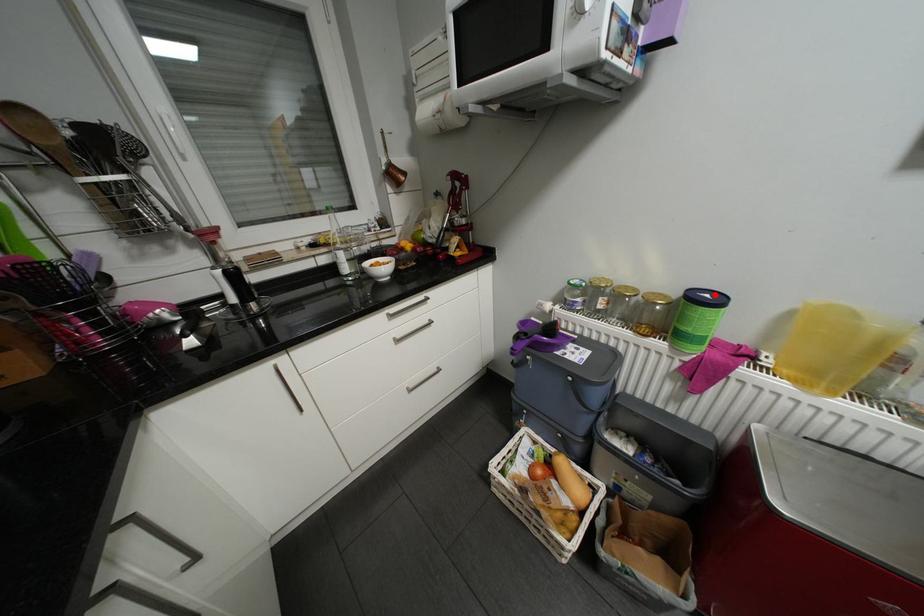
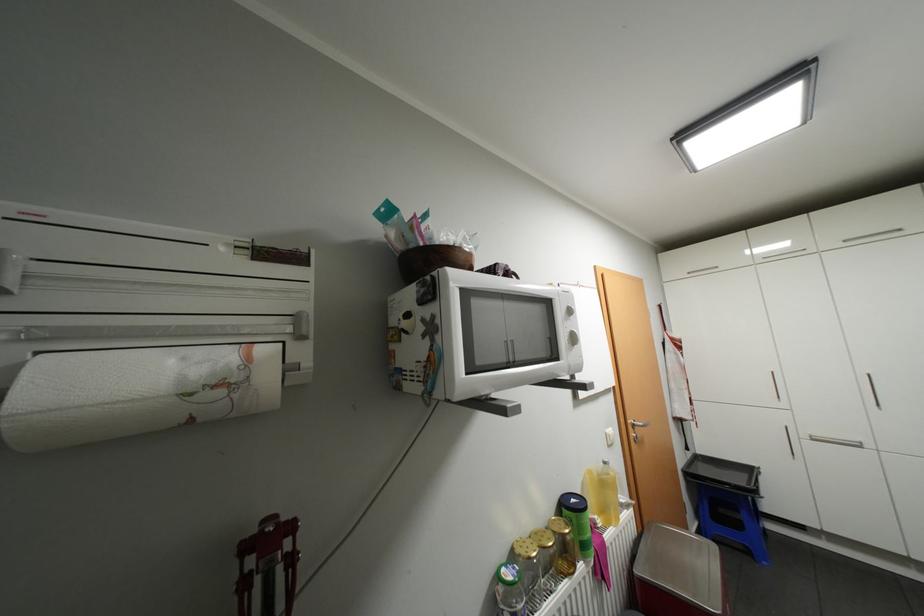
Find the pixel in the second image that matches the highlighted location in the first image.

(580, 499)